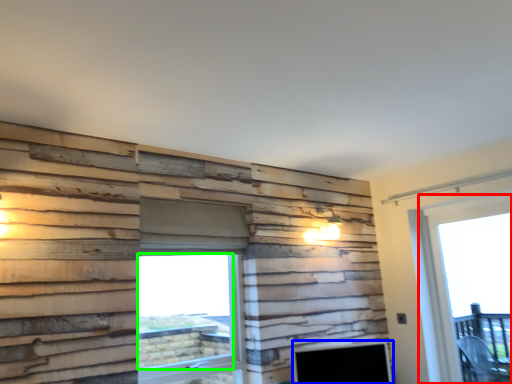
Question: Based on their relative distances, which object is farther from window (highlighted by a red box)? Choose from fireplace (highlighted by a blue box) and window screen (highlighted by a green box).

Choices:
 (A) fireplace
 (B) window screen

Answer: (B)